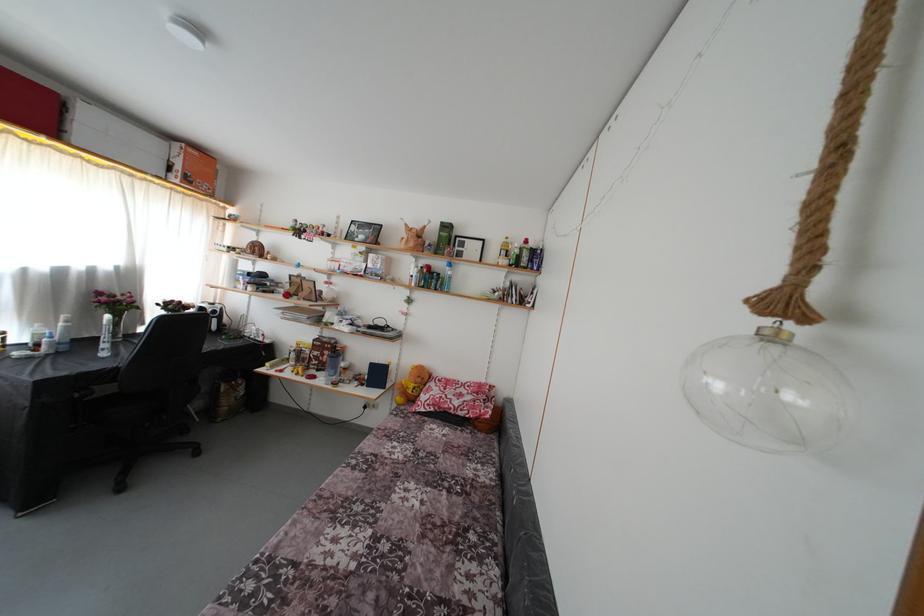
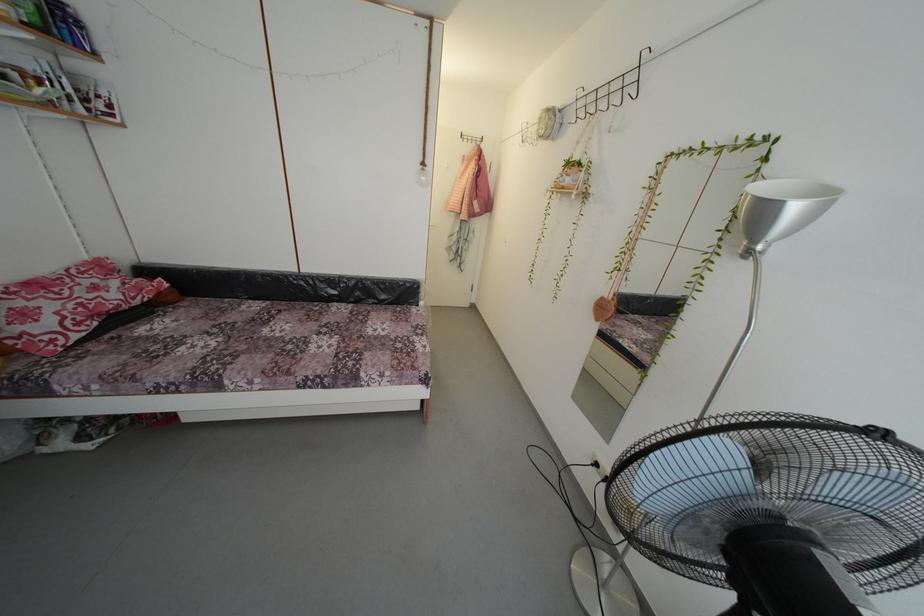
Locate, in the second image, the point that corresponds to point 441,392 in the first image.

(34, 306)